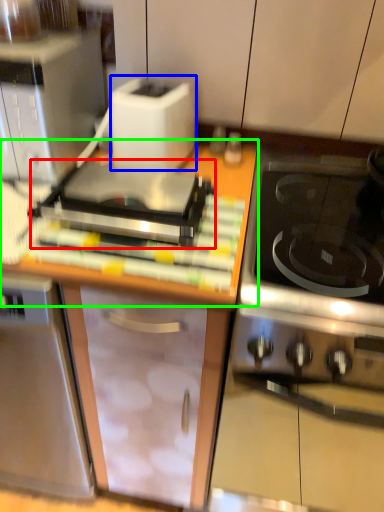
Question: Which object is positioned farthest from appliance (highlighted by a red box)? Select from toaster (highlighted by a blue box) and countertop (highlighted by a green box).

Choices:
 (A) toaster
 (B) countertop

Answer: (A)